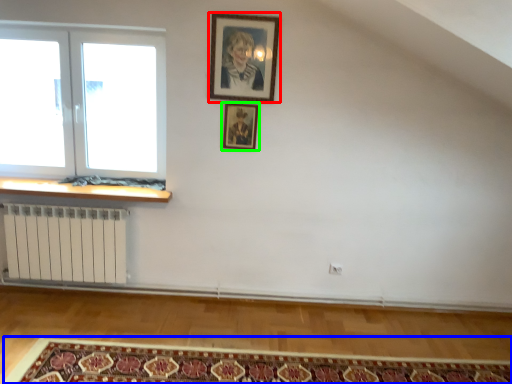
Question: Considering the real-world distances, which object is closest to picture frame (highlighted by a red box)? mat (highlighted by a blue box) or picture frame (highlighted by a green box).

Choices:
 (A) mat
 (B) picture frame

Answer: (B)